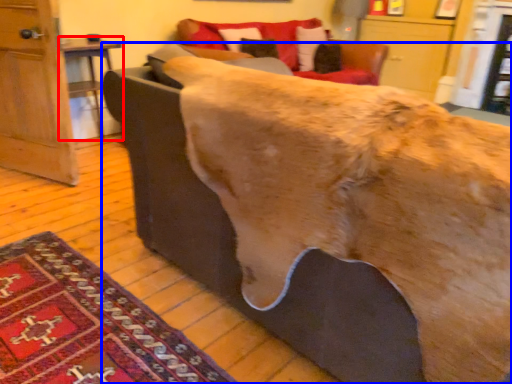
Question: Which of the following is the closest to the observer, table (highlighted by a red box) or furniture (highlighted by a blue box)?

Choices:
 (A) table
 (B) furniture

Answer: (B)